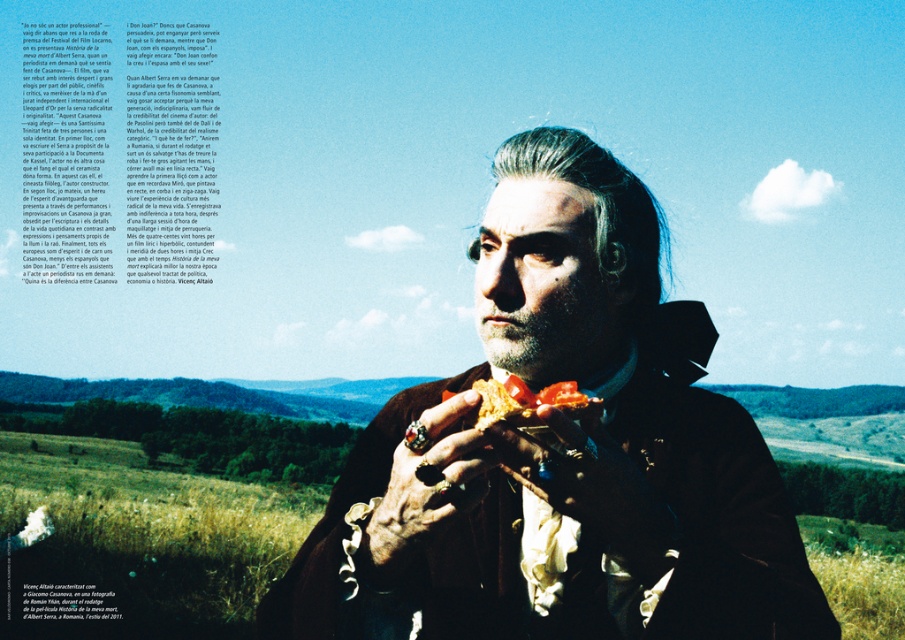
In the scene shown: What is located at the coordinates point (589, 481)?

The rustic leather glove at center is located at point (589, 481).

You are an assistant helping a tailor measure garments for a historical reenactment. You have a velvet brown coat at center and a rustic leather glove at center. The tailor wants to know which item is wider. Which one should you inform them about?

The velvet brown coat at center is wider than the rustic leather glove at center.